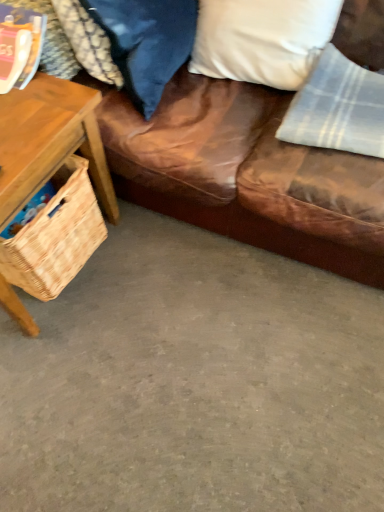
Question: Does point (148, 1) appear closer or farther from the camera than point (349, 396)?

Choices:
 (A) farther
 (B) closer

Answer: (B)

Question: In the image, is velvet blue pillow at upper center, which is counted as the second pillow, starting from the right, positioned in front of or behind gray concrete floor at lower center?

Choices:
 (A) behind
 (B) front

Answer: (A)

Question: Which of these objects is positioned farthest from the brown leather couch at upper right?

Choices:
 (A) gray concrete floor at lower center
 (B) woven wood basket at left
 (C) light gray plaid fabric at upper right
 (D) white soft pillow at upper right, which is the 2th pillow in left-to-right order
 (E) woven straw picnic basket at left

Answer: (A)

Question: Considering the real-world distances, which object is closest to the white soft pillow at upper right, which ranks as the first pillow in right-to-left order?

Choices:
 (A) velvet blue pillow at upper center, placed as the 1th pillow when sorted from left to right
 (B) woven straw picnic basket at left
 (C) light gray plaid fabric at upper right
 (D) brown leather couch at upper right
 (E) woven wood basket at left

Answer: (C)